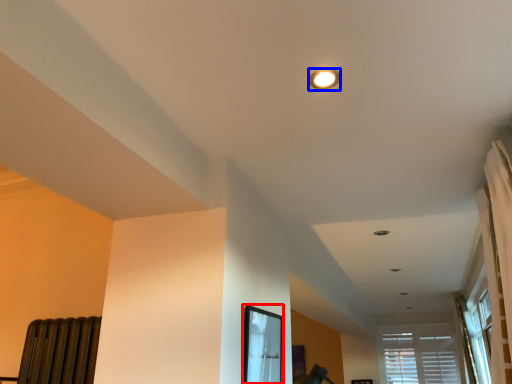
Question: Which object is further to the camera taking this photo, bay window (highlighted by a red box) or lighting (highlighted by a blue box)?

Choices:
 (A) bay window
 (B) lighting

Answer: (A)